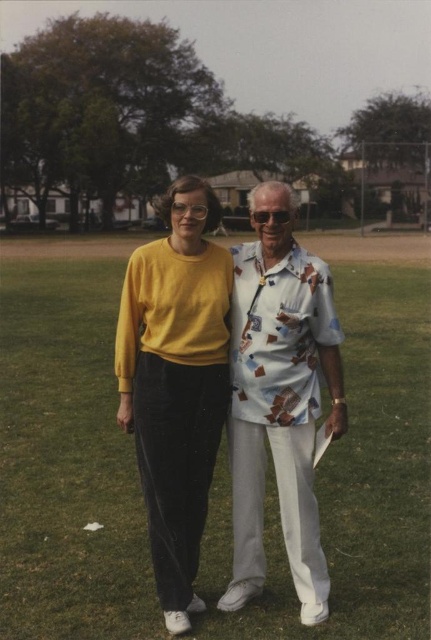
Who is shorter, matte yellow sweater at center or printed cotton shirt at center?

printed cotton shirt at center is shorter.

Which is in front, point (137, 353) or point (249, 317)?

Positioned in front is point (249, 317).

Is point (178, 330) more distant than point (315, 593)?

Yes.

Where is `matte yellow sweater at center`? This screenshot has width=431, height=640. matte yellow sweater at center is located at coordinates (175, 381).

Is the position of green grass at center less distant than that of printed cotton shirt at center?

Yes, it is.

Who is positioned more to the left, green grass at center or printed cotton shirt at center?

Positioned to the left is green grass at center.

Measure the distance between point (x=374, y=497) and camera.

A distance of 6.20 meters exists between point (x=374, y=497) and camera.

Where is `green grass at center`? The height and width of the screenshot is (640, 431). green grass at center is located at coordinates (66, 461).

Between green grass at center and matte yellow sweater at center, which one is positioned higher?

green grass at center

Who is shorter, green grass at center or matte yellow sweater at center?

With less height is green grass at center.

Does point (46, 561) come in front of point (203, 500)?

No, (46, 561) is behind (203, 500).

Identify the location of green grass at center. The width and height of the screenshot is (431, 640). (66, 461).